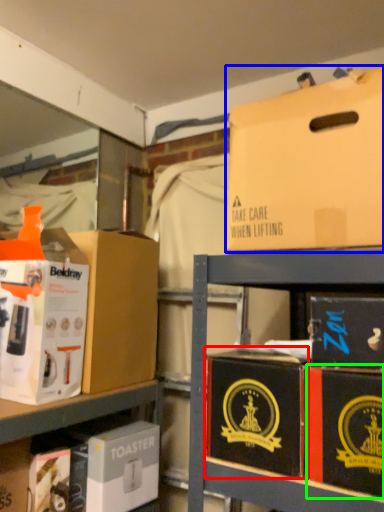
Question: Considering the real-world distances, which object is farthest from box (highlighted by a red box)? box (highlighted by a blue box) or box (highlighted by a green box)?

Choices:
 (A) box
 (B) box

Answer: (A)